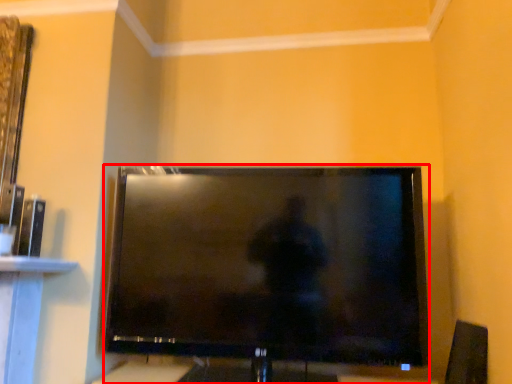
Question: From the image's perspective, where is television (annotated by the red box) located relative to speaker?

Choices:
 (A) below
 (B) above

Answer: (B)